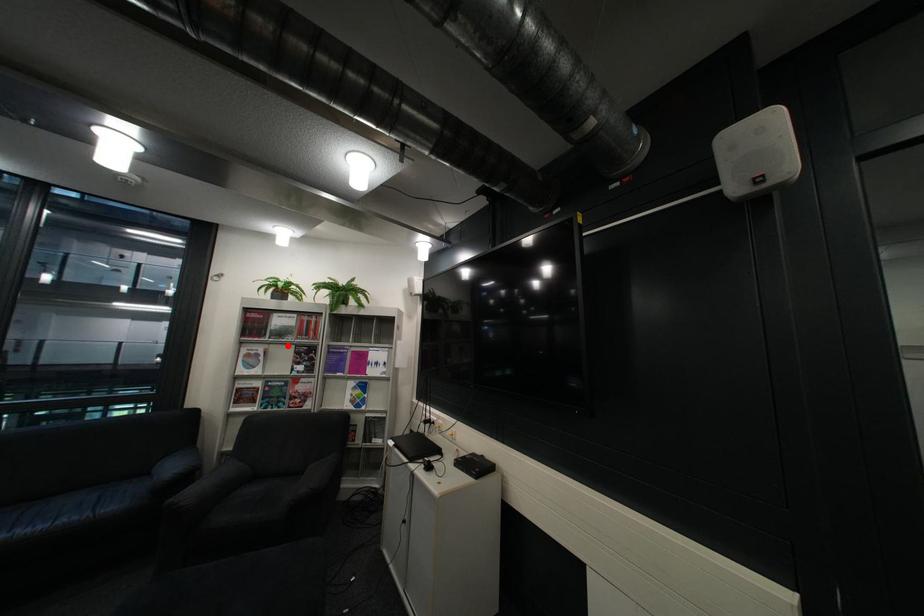
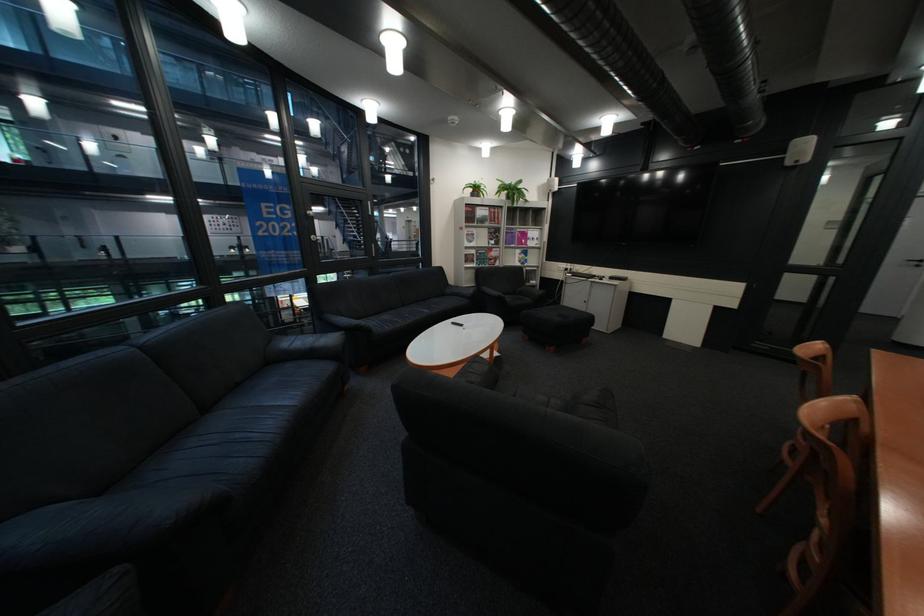
The point at the highlighted location is marked in the first image. Where is the corresponding point in the second image?

(492, 229)